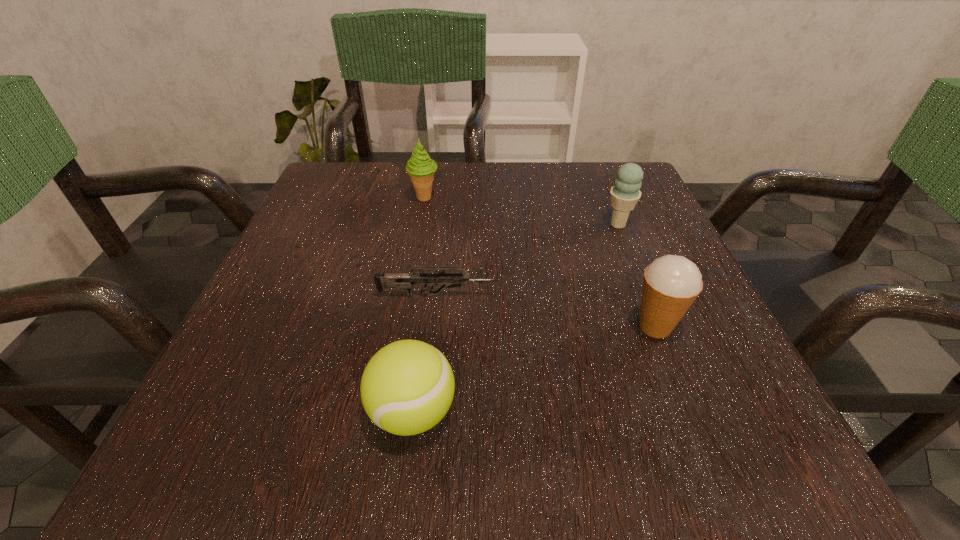
Find the location of a particular element. This screenshot has width=960, height=540. free space at the near left corner of the desktop is located at coordinates (204, 457).

Image resolution: width=960 pixels, height=540 pixels. Find the location of `vacant space at the far right corner`. vacant space at the far right corner is located at coordinates (645, 200).

This screenshot has width=960, height=540. I want to click on vacant area that lies between the leftmost icecream and the gun, so click(x=431, y=246).

The image size is (960, 540). What are the coordinates of `blank region between the second nearest icecream and the farthest icecream` in the screenshot? It's located at (521, 211).

Locate an element on the screen. The image size is (960, 540). empty space that is in between the fourth nearest object and the leftmost icecream is located at coordinates (521, 211).

The width and height of the screenshot is (960, 540). Identify the location of free point between the second farthest icecream and the tennis ball. (516, 318).

Identify the location of vacant area between the gun and the leftmost icecream. This screenshot has height=540, width=960. (431, 246).

I want to click on free spot between the second nearest icecream and the nearest object, so click(x=516, y=318).

At what (x,y) coordinates should I click in order to perform the action: click on free space between the shortest object and the leftmost icecream. Please return your answer as a coordinate pair (x, y). Looking at the image, I should click on (431, 246).

The image size is (960, 540). Identify the location of free space between the nearest icecream and the second shortest object. (534, 369).